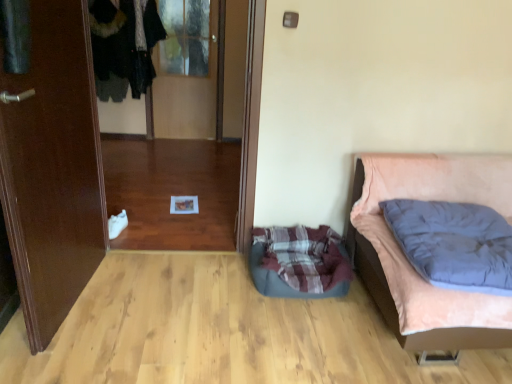
Locate an element on the screen. The width and height of the screenshot is (512, 384). free space to the left of plaid fabric dog bed at lower center is located at coordinates (214, 282).